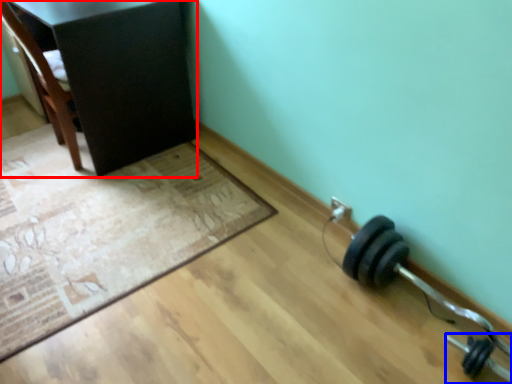
Question: Which object appears closest to the camera in this image, furniture (highlighted by a red box) or dumbbell (highlighted by a blue box)?

Choices:
 (A) furniture
 (B) dumbbell

Answer: (B)